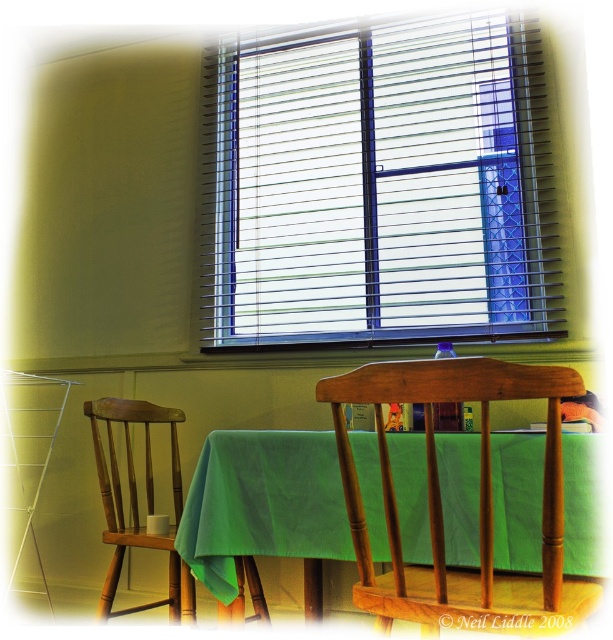
Question: Does white plastic blinds at upper center appear over wooden chair at center?

Choices:
 (A) no
 (B) yes

Answer: (B)

Question: Does wooden chair at center have a greater width compared to wooden chair at left?

Choices:
 (A) yes
 (B) no

Answer: (B)

Question: Which is farther from the wooden chair at left?

Choices:
 (A) wooden chair at center
 (B) green fabric tablecloth at center

Answer: (A)

Question: Considering the real-world distances, which object is closest to the wooden chair at center?

Choices:
 (A) white plastic blinds at upper center
 (B) green fabric tablecloth at center
 (C) wooden chair at left

Answer: (B)

Question: Is white plastic blinds at upper center wider than green fabric tablecloth at center?

Choices:
 (A) no
 (B) yes

Answer: (B)

Question: Which of the following is the closest to the observer?

Choices:
 (A) wooden chair at center
 (B) white plastic blinds at upper center
 (C) wooden chair at left
 (D) green fabric tablecloth at center

Answer: (A)